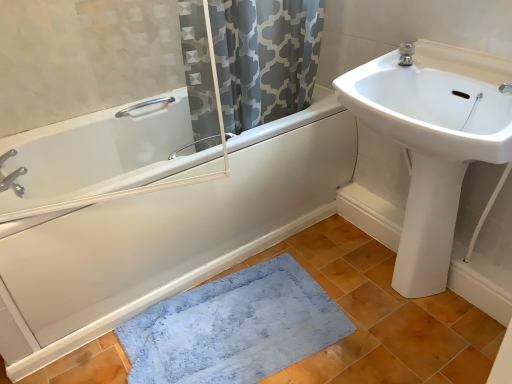
Locate an element on the screen. The height and width of the screenshot is (384, 512). satin nickel faucet at upper right, which is counted as the second tap, starting from the left is located at coordinates (406, 53).

Locate an element on the screen. The width and height of the screenshot is (512, 384). brushed metal faucet at upper left, the first tap when ordered from left to right is located at coordinates (13, 181).

What is the approximate width of white glossy sink at upper right?

white glossy sink at upper right is 17.01 inches wide.

Measure the distance between point (x=367, y=99) and camera.

4.37 feet.

Where is `white glossy bidet at right`? white glossy bidet at right is located at coordinates (428, 226).

I want to click on white glossy bathtub at left, so click(166, 235).

Which point is more distant from viewer, (199, 86) or (413, 262)?

The point (413, 262) is farther from the camera.

From a real-world perspective, is gray printed fabric at upper center physically located above or below white glossy sink at upper right?

gray printed fabric at upper center is above white glossy sink at upper right.

Is gray printed fabric at upper center closer to the viewer compared to white glossy sink at upper right?

No, gray printed fabric at upper center is further to the viewer.

Does gray printed fabric at upper center touch white glossy sink at upper right?

No, gray printed fabric at upper center is not making contact with white glossy sink at upper right.

Does satin nickel faucet at upper right, acting as the first tap starting from the top, have a larger size compared to white glossy bathtub at left?

No.

Is satin nickel faucet at upper right, which is counted as the second tap, starting from the left, taller or shorter than white glossy bathtub at left?

In the image, satin nickel faucet at upper right, which is counted as the second tap, starting from the left, appears to be shorter than white glossy bathtub at left.

How distant is satin nickel faucet at upper right, acting as the first tap starting from the top, from white glossy bathtub at left?

The distance of satin nickel faucet at upper right, acting as the first tap starting from the top, from white glossy bathtub at left is 36.68 inches.

Which object is closer to the camera taking this photo, satin nickel faucet at upper right, positioned as the 2th tap in bottom-to-top order, or white glossy bathtub at left?

white glossy bathtub at left is closer to the camera.

Can we say white glossy bidet at right lies outside gray printed fabric at upper center?

That's correct, white glossy bidet at right is outside of gray printed fabric at upper center.

Between white glossy bidet at right and gray printed fabric at upper center, which one has larger size?

Bigger between the two is gray printed fabric at upper center.

Is white glossy bidet at right wider or thinner than gray printed fabric at upper center?

white glossy bidet at right is thinner than gray printed fabric at upper center.

From the image's perspective, is brushed metal faucet at upper left, the 2th tap in the right-to-left sequence, located above or below white glossy bathtub at left?

brushed metal faucet at upper left, the 2th tap in the right-to-left sequence, is situated lower than white glossy bathtub at left in the image.

Considering the sizes of brushed metal faucet at upper left, which is counted as the first tap, starting from the bottom, and white glossy bathtub at left in the image, is brushed metal faucet at upper left, which is counted as the first tap, starting from the bottom, wider or thinner than white glossy bathtub at left?

Considering their sizes, brushed metal faucet at upper left, which is counted as the first tap, starting from the bottom, looks slimmer than white glossy bathtub at left.

Is brushed metal faucet at upper left, which is the 2th tap in top-to-bottom order, spatially inside white glossy bathtub at left, or outside of it?

The correct answer is: outside.

Is brushed metal faucet at upper left, which is counted as the first tap, starting from the bottom, taller or shorter than white glossy bathtub at left?

brushed metal faucet at upper left, which is counted as the first tap, starting from the bottom, is shorter than white glossy bathtub at left.

Can you confirm if brushed metal faucet at upper left, which is counted as the first tap, starting from the bottom, is thinner than blue plush bath mat at lower center?

Yes, brushed metal faucet at upper left, which is counted as the first tap, starting from the bottom, is thinner than blue plush bath mat at lower center.

From a real-world perspective, is brushed metal faucet at upper left, which is the 2th tap in top-to-bottom order, located beneath blue plush bath mat at lower center?

No, from a real-world perspective, brushed metal faucet at upper left, which is the 2th tap in top-to-bottom order, is not beneath blue plush bath mat at lower center.

Is brushed metal faucet at upper left, the 2th tap in the right-to-left sequence, in front of or behind blue plush bath mat at lower center in the image?

brushed metal faucet at upper left, the 2th tap in the right-to-left sequence, is behind blue plush bath mat at lower center.

Is white glossy bathtub at left not near white glossy bidet at right?

Yes, white glossy bathtub at left and white glossy bidet at right are quite far apart.

Looking at this image, is white glossy bathtub at left at the left side of white glossy bidet at right?

Yes.

Where is `bath that appears above the white glossy bidet at right (from a real-world perspective)`? bath that appears above the white glossy bidet at right (from a real-world perspective) is located at coordinates (103, 156).

Is white glossy bathtub at left spatially inside white glossy bidet at right, or outside of it?

white glossy bathtub at left is outside white glossy bidet at right.

Between white glossy bathtub at left and gray printed fabric at upper center, which one appears on the left side from the viewer's perspective?

From the viewer's perspective, white glossy bathtub at left appears more on the left side.

What's the angular difference between white glossy bathtub at left and gray printed fabric at upper center's facing directions?

There is a 0.263-degree angle between the facing directions of white glossy bathtub at left and gray printed fabric at upper center.

Could you tell me if white glossy bathtub at left is facing gray printed fabric at upper center?

No, white glossy bathtub at left does not turn towards gray printed fabric at upper center.

From a real-world perspective, is white glossy bathtub at left beneath gray printed fabric at upper center?

Yes, from a real-world perspective, white glossy bathtub at left is below gray printed fabric at upper center.

I want to click on shower curtain behind the white glossy sink at upper right, so click(x=265, y=58).

Image resolution: width=512 pixels, height=384 pixels. Identify the location of tap above the white glossy bathtub at left (from the image's perspective). (406, 53).

Which object lies nearer to the anchor point white glossy bathtub at left, white glossy bathtub at left or white glossy sink at upper right?

The object closer to white glossy bathtub at left is white glossy bathtub at left.

From the image, which object appears to be nearer to white glossy bathtub at left, white glossy sink at upper right or white glossy bidet at right?

Based on the image, white glossy sink at upper right appears to be nearer to white glossy bathtub at left.

Looking at the image, which one is located further to blue plush bath mat at lower center, white glossy bathtub at left or white glossy bathtub at left?

Among the two, white glossy bathtub at left is located further to blue plush bath mat at lower center.

Based on their spatial positions, is gray printed fabric at upper center or white glossy bathtub at left further from white glossy sink at upper right?

The object further to white glossy sink at upper right is white glossy bathtub at left.

Considering their positions, is brushed metal faucet at upper left, which is the 2th tap in top-to-bottom order, positioned closer to white glossy sink at upper right than gray printed fabric at upper center?

gray printed fabric at upper center is positioned closer to the anchor white glossy sink at upper right.

From the image, which object appears to be nearer to satin nickel faucet at upper right, positioned as the 2th tap in bottom-to-top order, gray printed fabric at upper center or blue plush bath mat at lower center?

gray printed fabric at upper center lies closer to satin nickel faucet at upper right, positioned as the 2th tap in bottom-to-top order, than the other object.

Based on their spatial positions, is blue plush bath mat at lower center or white glossy sink at upper right closer to white glossy bathtub at left?

blue plush bath mat at lower center is closer to white glossy bathtub at left.

Which object lies further to the anchor point white glossy bathtub at left, gray printed fabric at upper center or brushed metal faucet at upper left, the first tap when ordered from left to right?

gray printed fabric at upper center lies further to white glossy bathtub at left than the other object.

Where is `bathtub between satin nickel faucet at upper right, acting as the first tap starting from the top, and blue plush bath mat at lower center from top to bottom`? The width and height of the screenshot is (512, 384). bathtub between satin nickel faucet at upper right, acting as the first tap starting from the top, and blue plush bath mat at lower center from top to bottom is located at coordinates (166, 235).

I want to click on bathtub between brushed metal faucet at upper left, which is counted as the first tap, starting from the bottom, and satin nickel faucet at upper right, positioned as the 2th tap in bottom-to-top order, in the horizontal direction, so click(166, 235).

The width and height of the screenshot is (512, 384). Find the location of `bath located between brushed metal faucet at upper left, the first tap when ordered from left to right, and white glossy bathtub at left in the left-right direction`. bath located between brushed metal faucet at upper left, the first tap when ordered from left to right, and white glossy bathtub at left in the left-right direction is located at coordinates (103, 156).

At what (x,y) coordinates should I click in order to perform the action: click on bathtub located between brushed metal faucet at upper left, which is the 2th tap in top-to-bottom order, and white glossy sink at upper right in the left-right direction. Please return your answer as a coordinate pair (x, y). The height and width of the screenshot is (384, 512). Looking at the image, I should click on (166, 235).